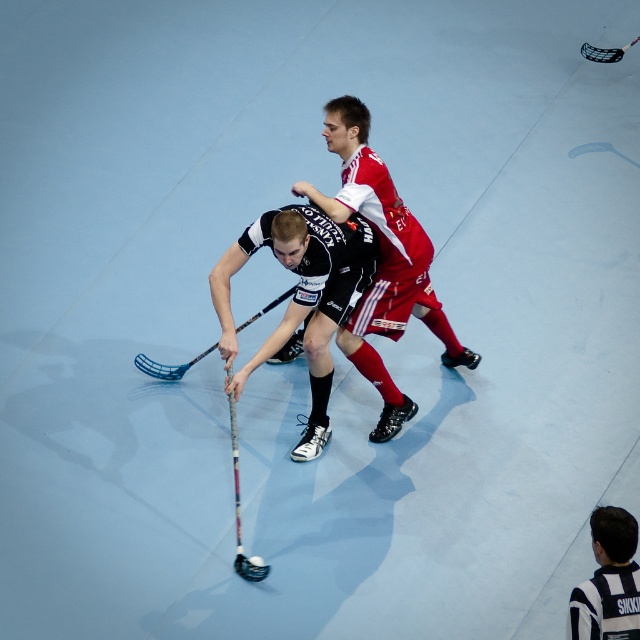
Can you confirm if black and white striped shirt at lower right is positioned above matte blue hockey stick at center?

Incorrect, black and white striped shirt at lower right is not positioned above matte blue hockey stick at center.

Find the location of a particular element. The image size is (640, 640). black and white striped shirt at lower right is located at coordinates (609, 580).

Identify the location of black and white striped shirt at lower right. [609, 580].

Who is more forward, (x=236, y=374) or (x=595, y=582)?

Point (x=595, y=582) is in front.

Is point (376, 257) in front of point (616, 550)?

No, (376, 257) is behind (616, 550).

Find the location of `black matte hockey stick at center`. black matte hockey stick at center is located at coordinates (301, 296).

Can you confirm if black matte hockey stick at center is smaller than matte blue hockey stick at center?

No.

Which is more to the right, black matte hockey stick at center or matte blue hockey stick at center?

black matte hockey stick at center is more to the right.

At what (x,y) coordinates should I click in order to perform the action: click on black matte hockey stick at center. Please return your answer as a coordinate pair (x, y). The image size is (640, 640). Looking at the image, I should click on (301, 296).